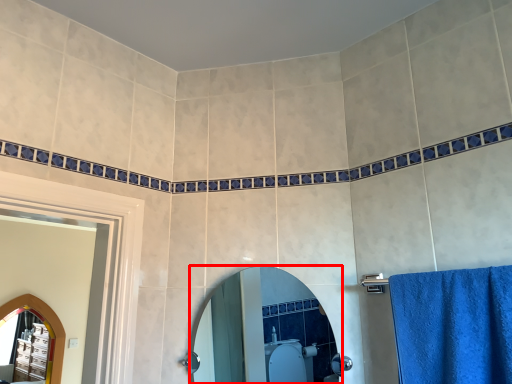
Question: In this image, where is mirror (annotated by the red box) located relative to mirror?

Choices:
 (A) right
 (B) left

Answer: (A)